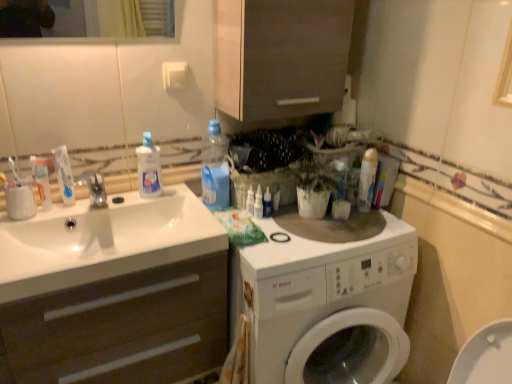
Locate an element on the screen. The width and height of the screenshot is (512, 384). free spot to the right of white glossy bottle at center, which ranks as the 3th toiletry in left-to-right order is located at coordinates (330, 224).